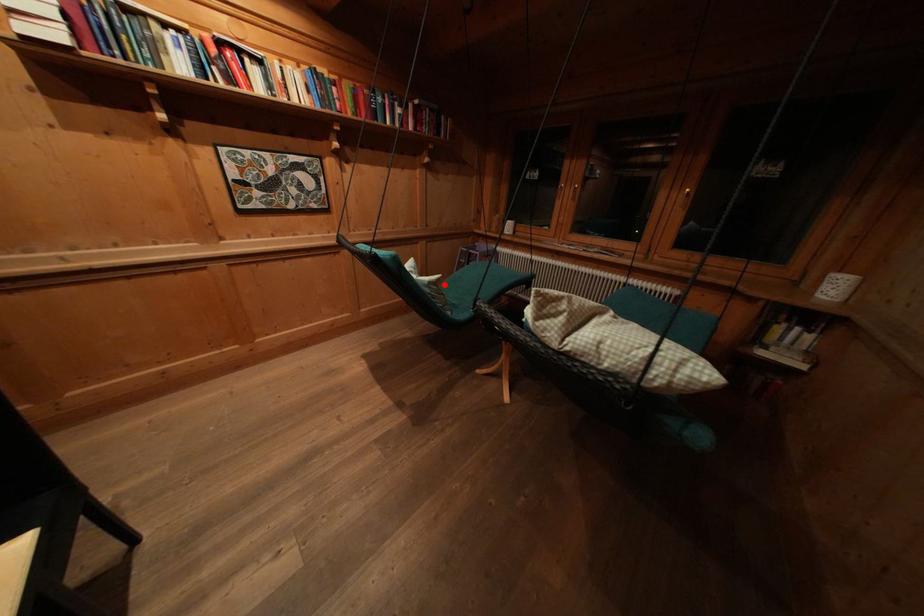
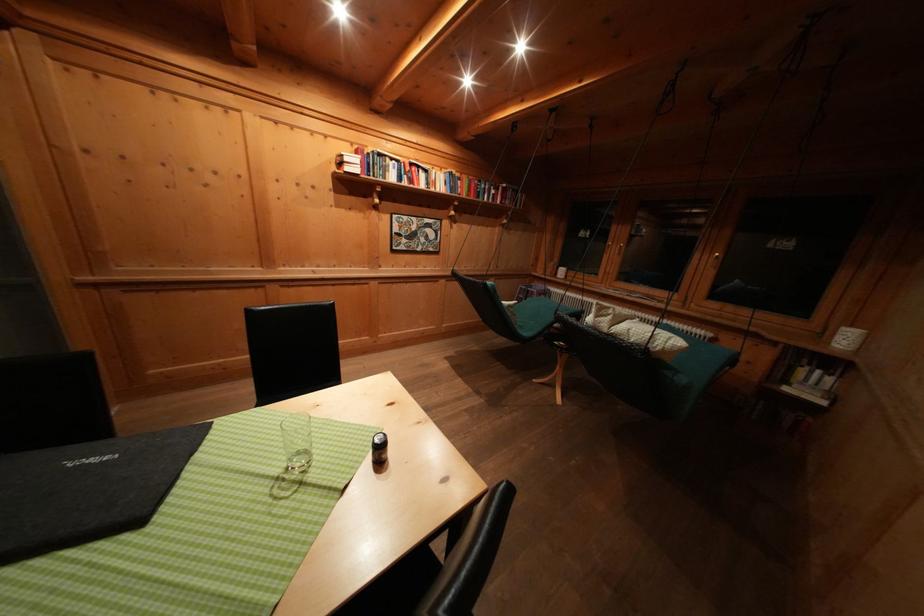
Question: I am providing you with two images of the same scene from different viewpoints. A red point is marked on the first image. Is the red point's position out of view in image 2?

Choices:
 (A) Yes
 (B) No

Answer: (B)